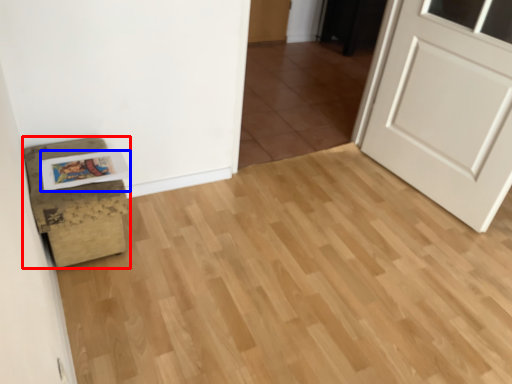
Question: Which of the following is the farthest to the observer, furniture (highlighted by a red box) or postcard (highlighted by a blue box)?

Choices:
 (A) furniture
 (B) postcard

Answer: (B)